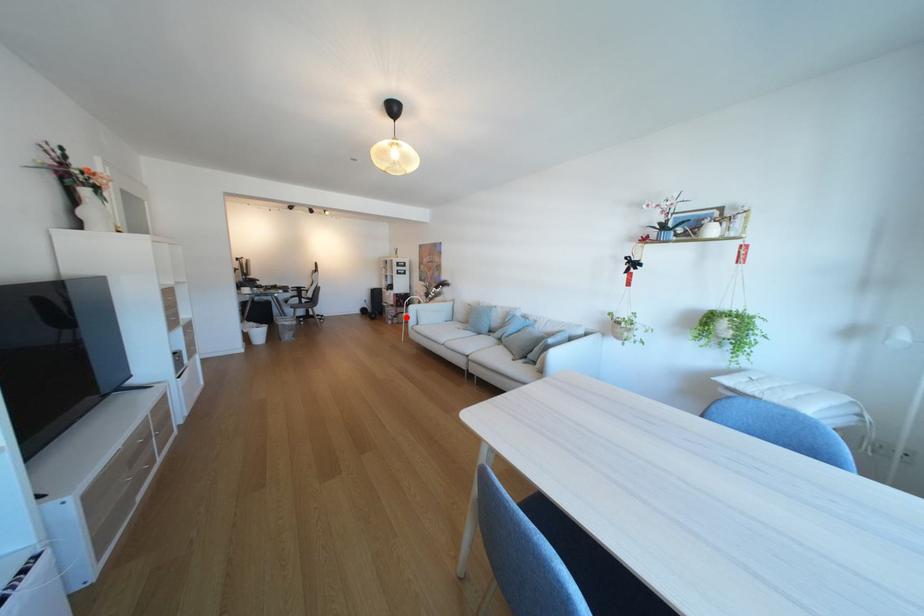
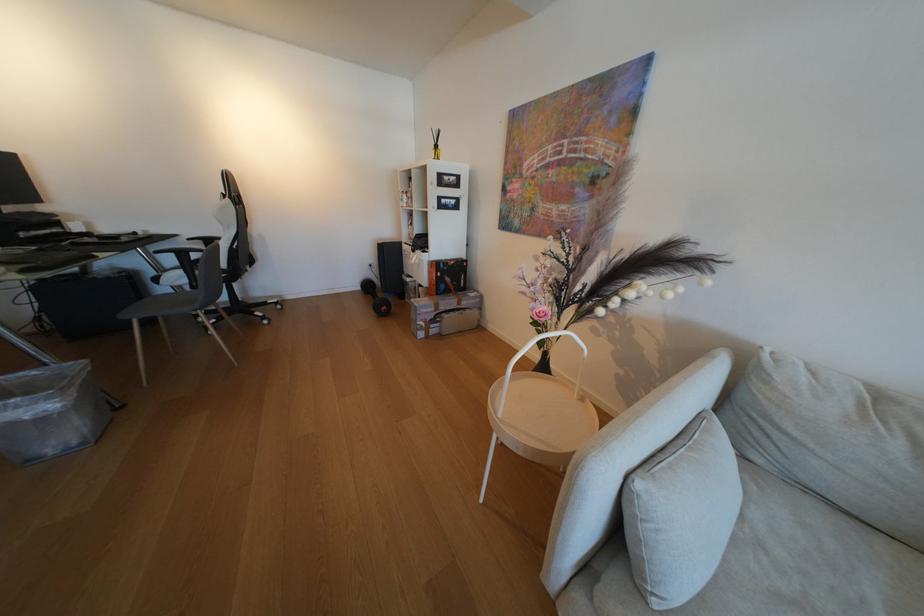
Question: I am providing you with two images of the same scene from different viewpoints. Given a red point in image1, look at the same physical point in image2. Is it:

Choices:
 (A) Closer to the viewpoint
 (B) Farther from the viewpoint

Answer: (A)